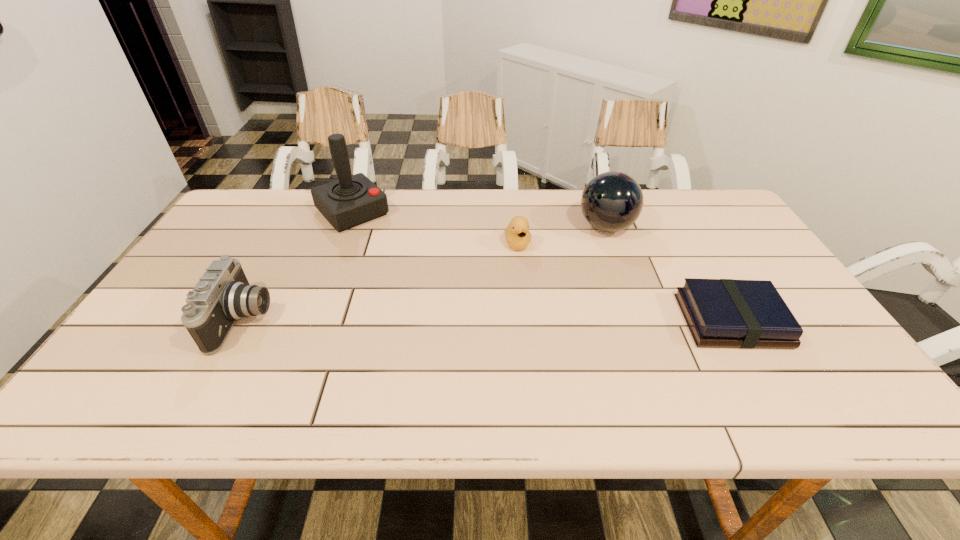
Find the location of a particular element. The width and height of the screenshot is (960, 540). object that stands as the second closest to the second shortest object is located at coordinates (352, 200).

The width and height of the screenshot is (960, 540). I want to click on free space that satisfies the following two spatial constraints: 1. on the front side of the joystick; 2. on the right side of the fourth tallest object, so click(x=341, y=244).